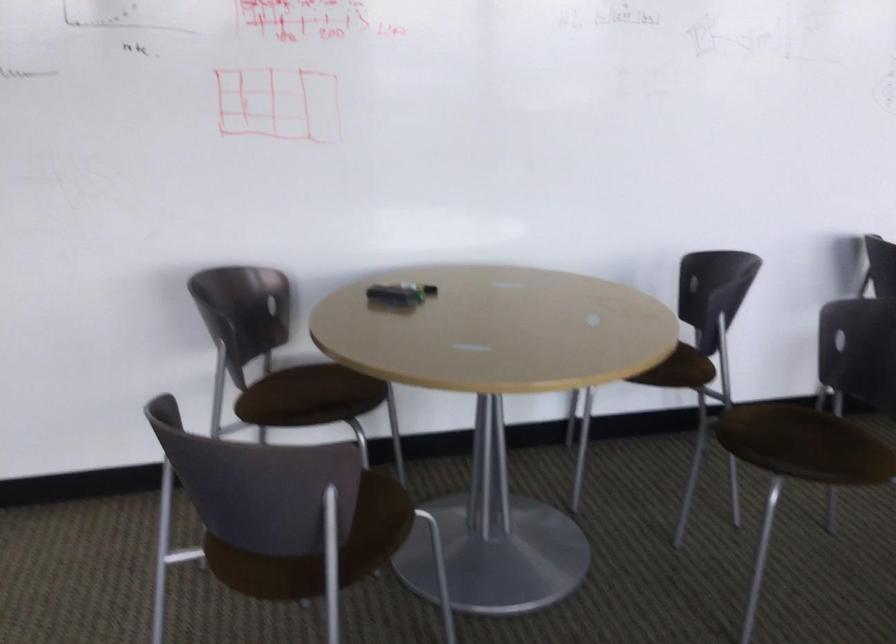
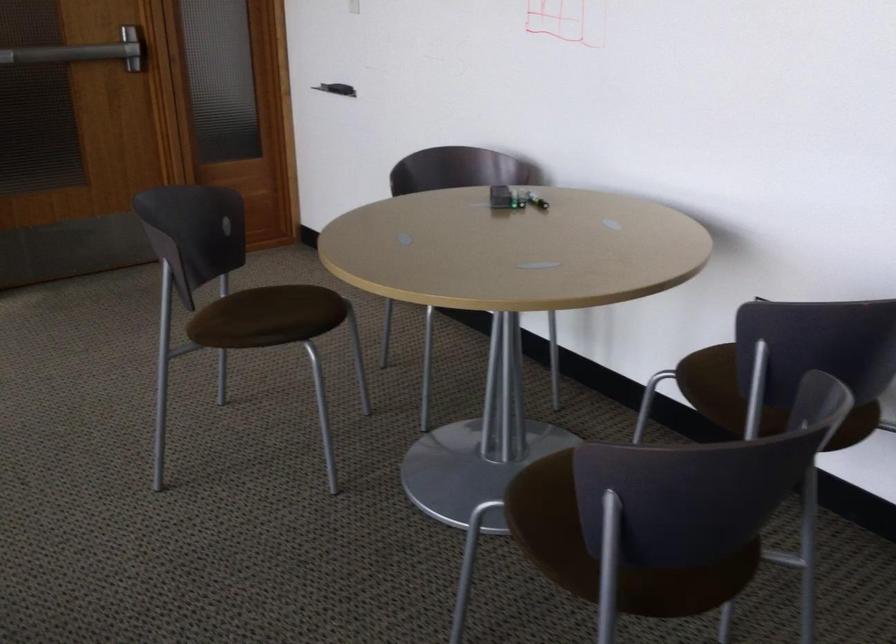
Where in the second image is the point corresponding to (804,458) from the first image?

(554, 524)